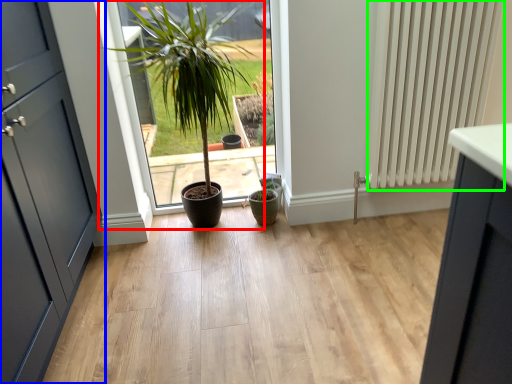
Question: Which is farther away from houseplant (highlighted by a red box)? door (highlighted by a blue box) or radiator (highlighted by a green box)?

Choices:
 (A) door
 (B) radiator

Answer: (B)